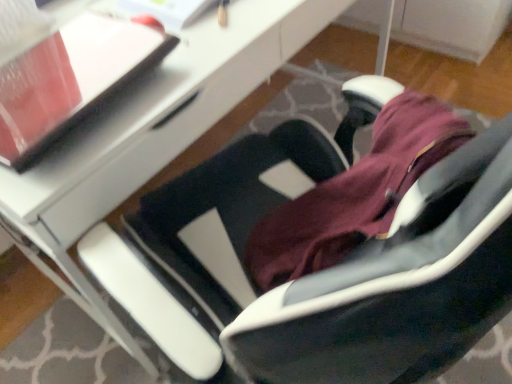
Question: Does white glossy desk at center appear on the right side of matte black notepad at upper left?

Choices:
 (A) no
 (B) yes

Answer: (B)

Question: Is white glossy desk at center taller than matte black notepad at upper left?

Choices:
 (A) yes
 (B) no

Answer: (A)

Question: Is white glossy desk at center surrounding matte black notepad at upper left?

Choices:
 (A) yes
 (B) no

Answer: (A)

Question: Does white glossy desk at center turn towards matte black notepad at upper left?

Choices:
 (A) yes
 (B) no

Answer: (B)

Question: From the image's perspective, is white glossy desk at center on top of matte black notepad at upper left?

Choices:
 (A) no
 (B) yes

Answer: (B)

Question: Does white glossy desk at center have a greater width compared to matte black notepad at upper left?

Choices:
 (A) yes
 (B) no

Answer: (A)

Question: Is matte black notepad at upper left not near white glossy desk at center?

Choices:
 (A) yes
 (B) no

Answer: (B)

Question: From the image's perspective, is matte black notepad at upper left below white glossy desk at center?

Choices:
 (A) no
 (B) yes

Answer: (B)

Question: From a real-world perspective, does matte black notepad at upper left sit lower than white glossy desk at center?

Choices:
 (A) no
 (B) yes

Answer: (A)

Question: Would you say matte black notepad at upper left contains white glossy desk at center?

Choices:
 (A) no
 (B) yes

Answer: (A)

Question: Is matte black notepad at upper left facing towards white glossy desk at center?

Choices:
 (A) no
 (B) yes

Answer: (A)

Question: Is matte black notepad at upper left shorter than white glossy desk at center?

Choices:
 (A) yes
 (B) no

Answer: (A)

Question: Which is correct: white glossy desk at center is inside matte black notepad at upper left, or outside of it?

Choices:
 (A) inside
 (B) outside

Answer: (B)